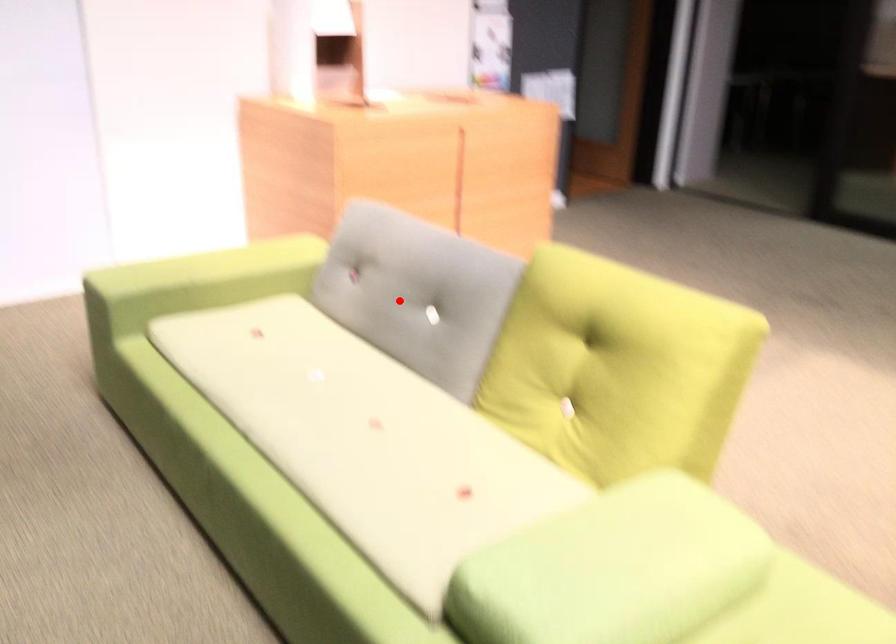
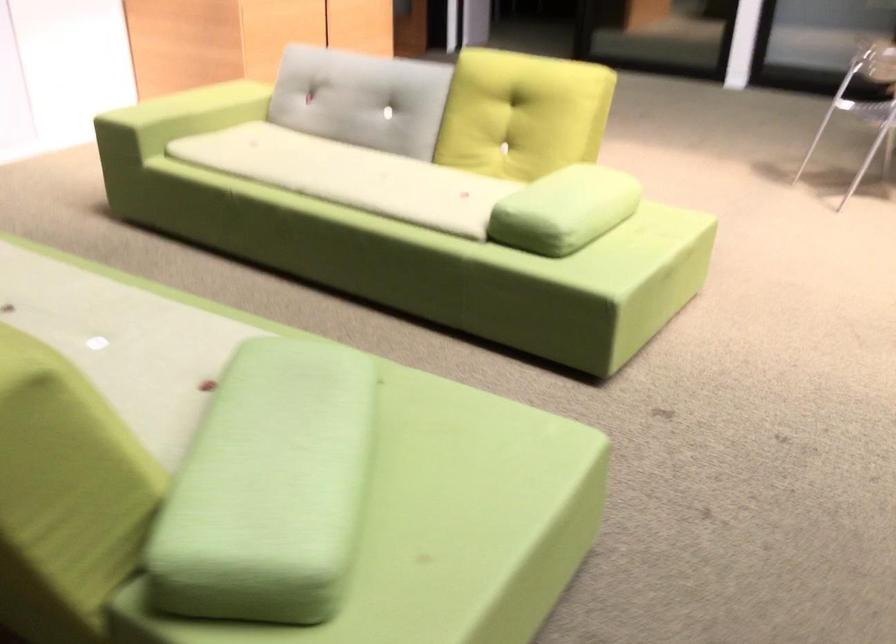
Locate, in the second image, the point that corresponds to the highlighted location in the first image.

(362, 99)